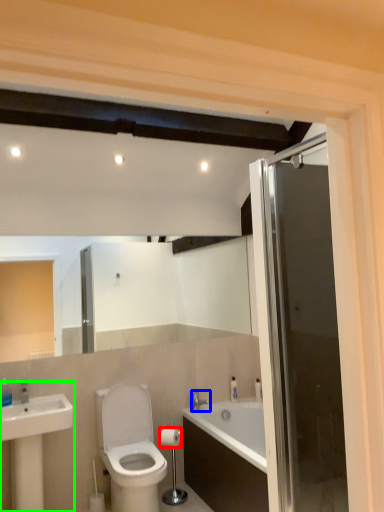
Question: Considering the real-world distances, which object is farthest from toilet paper (highlighted by a red box)? tap (highlighted by a blue box) or sink (highlighted by a green box)?

Choices:
 (A) tap
 (B) sink

Answer: (B)